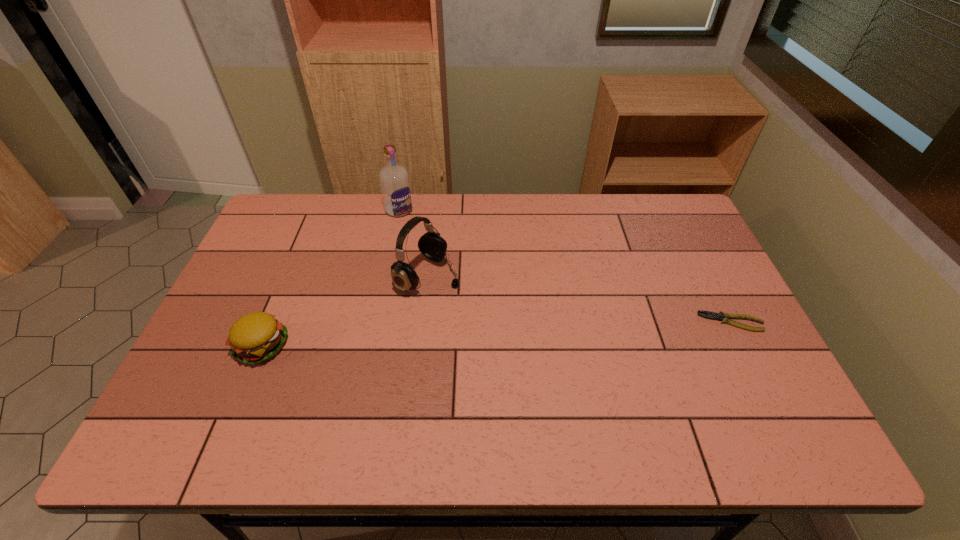
Identify the location of vacant area located with the microphone on the side of the second tallest object. (491, 304).

Image resolution: width=960 pixels, height=540 pixels. Identify the location of vacant region located 0.230m with the microphone on the side of the second tallest object. (526, 320).

At what (x,y) coordinates should I click in order to perform the action: click on free location located on the label of the vodka. Please return your answer as a coordinate pair (x, y). The image size is (960, 540). Looking at the image, I should click on (451, 269).

Locate an element on the screen. The height and width of the screenshot is (540, 960). vacant area located on the label of the vodka is located at coordinates (451, 269).

Identify the location of blank area located on the label of the vodka. The width and height of the screenshot is (960, 540). (464, 283).

Where is `object that is at the far edge`? object that is at the far edge is located at coordinates (394, 180).

Identify the location of object present at the left edge. This screenshot has width=960, height=540. (256, 337).

At what (x,y) coordinates should I click in order to perform the action: click on object positioned at the right edge. Please return your answer as a coordinate pair (x, y). Looking at the image, I should click on (721, 316).

Locate an element on the screen. free spot at the far edge of the desktop is located at coordinates 466,228.

At what (x,y) coordinates should I click in order to perform the action: click on blank space at the near edge of the desktop. Please return your answer as a coordinate pair (x, y). The image size is (960, 540). Looking at the image, I should click on (377, 377).